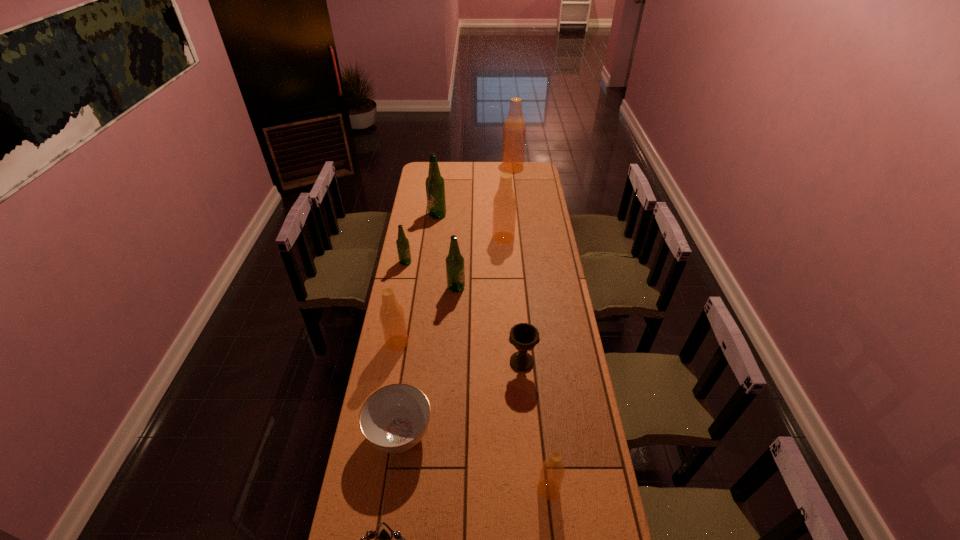
This screenshot has height=540, width=960. I want to click on blank space at the far edge of the desktop, so click(x=493, y=170).

Image resolution: width=960 pixels, height=540 pixels. Find the location of `free space at the right edge of the desktop`. free space at the right edge of the desktop is located at coordinates (557, 312).

You are a GUI agent. You are given a task and a screenshot of the screen. Output one action in this format:
    pyautogui.click(x=<x>, y=<y>)
    Task: Click on the vacant area that lies between the fourth nearest beer bottle and the chalice
    The width and height of the screenshot is (960, 540).
    Given the screenshot: What is the action you would take?
    pyautogui.click(x=464, y=312)

Where is `vacant space that is in between the farthest beer bottle and the red chalice`? This screenshot has width=960, height=540. vacant space that is in between the farthest beer bottle and the red chalice is located at coordinates (517, 265).

Locate an element on the screen. free space between the chalice and the third farthest tan beer bottle is located at coordinates (460, 353).

Where is `free point between the eighth tallest object and the second farthest object`? free point between the eighth tallest object and the second farthest object is located at coordinates (480, 288).

The height and width of the screenshot is (540, 960). Find the location of `vacant space in between the fifth object from right to left and the farthest object`. vacant space in between the fifth object from right to left and the farthest object is located at coordinates (485, 228).

I want to click on vacant space that's between the smallest tan beer bottle and the third biggest tan beer bottle, so click(x=473, y=416).

Identify which object is located as the ninth nearest to the tiara. Please provide its 2D coordinates. Your answer should be formatted as a tuple, i.e. [(x, y)], where the tuple contains the x and y coordinates of a point satisfying the conditions above.

[(514, 130)]

Identify the location of object identified as the ninth closest to the third biggest tan beer bottle. Image resolution: width=960 pixels, height=540 pixels. (514, 130).